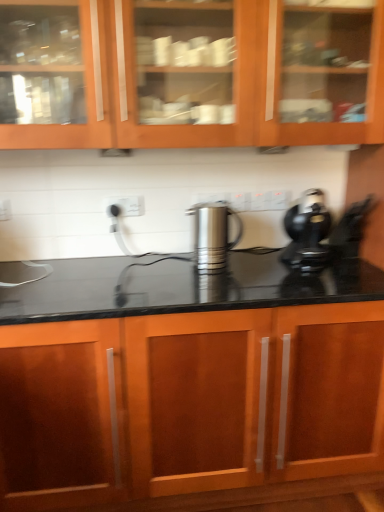
Question: From a real-world perspective, is satin silver kettle at center physically below wooden cabinet at upper center, the second cabinetry when ordered from bottom to top?

Choices:
 (A) no
 (B) yes

Answer: (B)

Question: Considering the relative sizes of satin silver kettle at center and wooden cabinet at upper center, the second cabinetry when ordered from bottom to top, in the image provided, is satin silver kettle at center shorter than wooden cabinet at upper center, the second cabinetry when ordered from bottom to top,?

Choices:
 (A) yes
 (B) no

Answer: (A)

Question: Is the position of satin silver kettle at center more distant than that of wooden cabinet at upper center, the second cabinetry when ordered from bottom to top?

Choices:
 (A) no
 (B) yes

Answer: (B)

Question: Is satin silver kettle at center oriented towards wooden cabinet at upper center, the second cabinetry when ordered from bottom to top?

Choices:
 (A) no
 (B) yes

Answer: (A)

Question: Does satin silver kettle at center have a greater width compared to wooden cabinet at upper center, the second cabinetry when ordered from bottom to top?

Choices:
 (A) no
 (B) yes

Answer: (A)

Question: Does satin silver kettle at center lie in front of wooden cabinet at upper center, marked as the 1th cabinetry in a top-to-bottom arrangement?

Choices:
 (A) no
 (B) yes

Answer: (A)

Question: Is wooden cabinet at center, the first cabinetry when ordered from bottom to top, beside satin silver kettle at center?

Choices:
 (A) yes
 (B) no

Answer: (B)

Question: Is satin silver kettle at center at the back of wooden cabinet at center, the first cabinetry when ordered from bottom to top?

Choices:
 (A) no
 (B) yes

Answer: (A)

Question: From a real-world perspective, does wooden cabinet at center, the first cabinetry when ordered from bottom to top, sit lower than satin silver kettle at center?

Choices:
 (A) no
 (B) yes

Answer: (B)

Question: Is wooden cabinet at center, the first cabinetry when ordered from bottom to top, outside satin silver kettle at center?

Choices:
 (A) yes
 (B) no

Answer: (A)

Question: From the image's perspective, is wooden cabinet at center, the first cabinetry when ordered from bottom to top, located above satin silver kettle at center?

Choices:
 (A) yes
 (B) no

Answer: (B)

Question: Can you confirm if wooden cabinet at center, the first cabinetry when ordered from bottom to top, is shorter than satin silver kettle at center?

Choices:
 (A) yes
 (B) no

Answer: (B)

Question: Considering the relative sizes of wooden cabinet at upper center, the second cabinetry when ordered from bottom to top, and black plastic coffee maker at right in the image provided, is wooden cabinet at upper center, the second cabinetry when ordered from bottom to top, smaller than black plastic coffee maker at right?

Choices:
 (A) no
 (B) yes

Answer: (A)